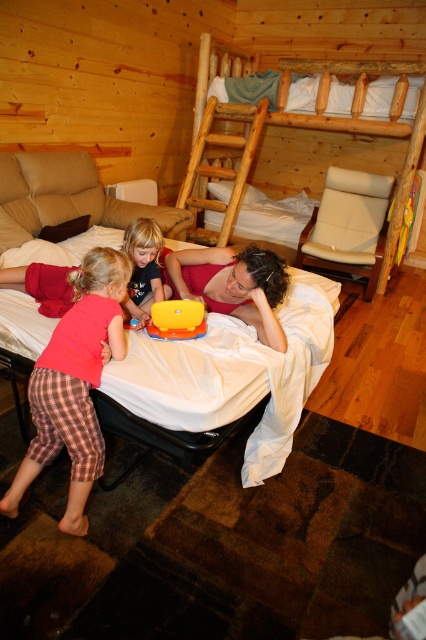
You are standing in the cabin and want to reach a specific point to place a small nightlight. The point is located at coordinates point (x=270, y=112). Considering the room layout described, can you safely place the nightlight at that point without it being in the way of the beds?

The distance of point (x=270, y=112) from viewer is 4.37 meters. Since the point is 4.37 meters away from you, you can safely place the nightlight there as it is not obstructed by the beds which are closer to the viewer.

You are a photographer setting up a shot of the scene. You want to ensure the matte pink shirt at center and the white soft pillow at upper center are both visible in the frame. Based on their positions, which object should you focus on first to capture both in the same shot?

The matte pink shirt at center is located below the white soft pillow at upper center, so focusing on the white soft pillow at upper center first would allow both objects to be captured in the frame since the shirt is positioned lower.